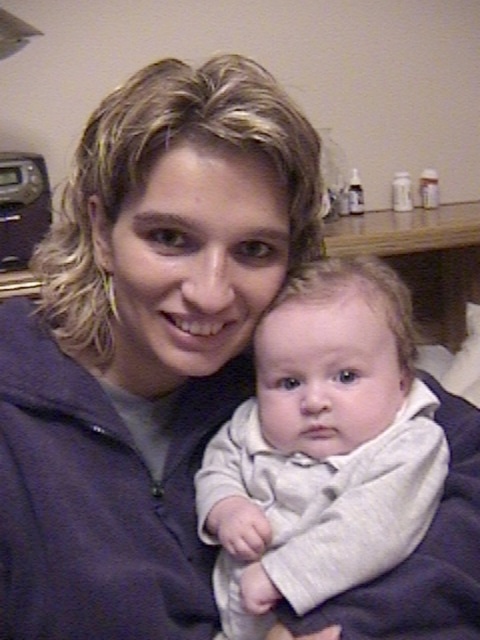
Between dark blue fleece at center and white soft baby at center, which one has more height?

dark blue fleece at center is taller.

Does dark blue fleece at center appear on the left side of white soft baby at center?

Correct, you'll find dark blue fleece at center to the left of white soft baby at center.

Describe the element at coordinates (144, 346) in the screenshot. The width and height of the screenshot is (480, 640). I see `dark blue fleece at center` at that location.

Find the location of a particular element. The image size is (480, 640). dark blue fleece at center is located at coordinates (144, 346).